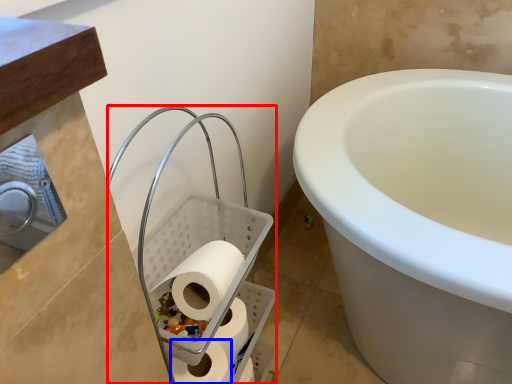
Question: Which object is closer to the camera taking this photo, laundry basket (highlighted by a red box) or toilet paper (highlighted by a blue box)?

Choices:
 (A) laundry basket
 (B) toilet paper

Answer: (A)